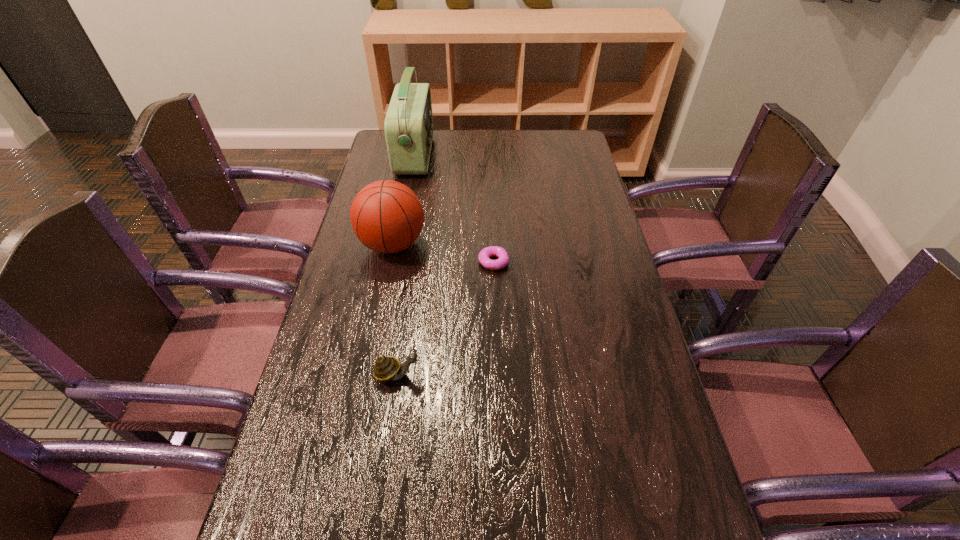
Find the location of `free location that satisfies the following two spatial constraints: 1. on the front side of the doughnut; 2. on the face of the snail`. free location that satisfies the following two spatial constraints: 1. on the front side of the doughnut; 2. on the face of the snail is located at coordinates (497, 374).

You are a GUI agent. You are given a task and a screenshot of the screen. Output one action in this format:
    pyautogui.click(x=<x>, y=<y>)
    Task: Click on the free space in the image that satisfies the following two spatial constraints: 1. on the front panel of the radio receiver; 2. on the left side of the shortest object
    This screenshot has height=540, width=960.
    Given the screenshot: What is the action you would take?
    pyautogui.click(x=395, y=262)

At what (x,y) coordinates should I click in order to perform the action: click on blank space that satisfies the following two spatial constraints: 1. on the front side of the rightmost object; 2. on the face of the third tallest object. Please return your answer as a coordinate pair (x, y). The width and height of the screenshot is (960, 540). Looking at the image, I should click on (497, 374).

You are a GUI agent. You are given a task and a screenshot of the screen. Output one action in this format:
    pyautogui.click(x=<x>, y=<y>)
    Task: Click on the free space that satisfies the following two spatial constraints: 1. on the front side of the rightmost object; 2. on the face of the second shortest object
    This screenshot has height=540, width=960.
    Given the screenshot: What is the action you would take?
    pyautogui.click(x=497, y=374)